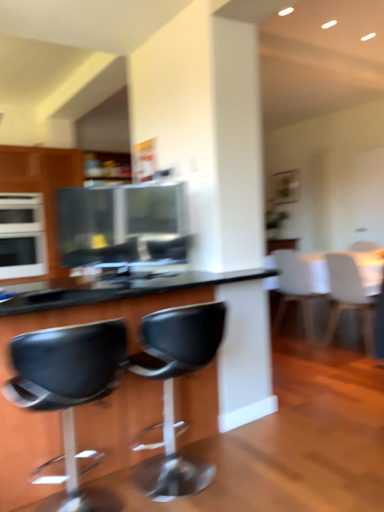
Question: From the image's perspective, is black plastic chair at center, the third chair when ordered from back to front, located above or below black plastic table at center, the 2th table positioned from the back?

Choices:
 (A) below
 (B) above

Answer: (A)

Question: From a real-world perspective, relative to black plastic table at center, the first table positioned from the front, is black plastic chair at center, the third chair when ordered from back to front, vertically above or below?

Choices:
 (A) below
 (B) above

Answer: (A)

Question: Which object is the farthest from the black leather stool at lower left, placed as the fourth chair when sorted from right to left?

Choices:
 (A) black plastic table at center, the 2th table positioned from the back
 (B) black plastic chair at center, the 3th chair from the right
 (C) metallic silver microwave at center, arranged as the second appliance when viewed from the back
 (D) white matte chair at right, which ranks as the second chair in right-to-left order
 (E) white glossy oven at left, the 1th appliance from the left

Answer: (E)

Question: Which object is the closest to the black plastic chair at center, acting as the 2th chair starting from the left?

Choices:
 (A) white glossy oven at left, which appears as the second appliance when viewed from the front
 (B) black plastic table at center, the first table positioned from the front
 (C) white matte chair at right, the 4th chair viewed from the front
 (D) black leather stool at lower left, which is counted as the 4th chair, starting from the back
 (E) metallic silver microwave at center, which ranks as the 1th appliance in right-to-left order

Answer: (D)